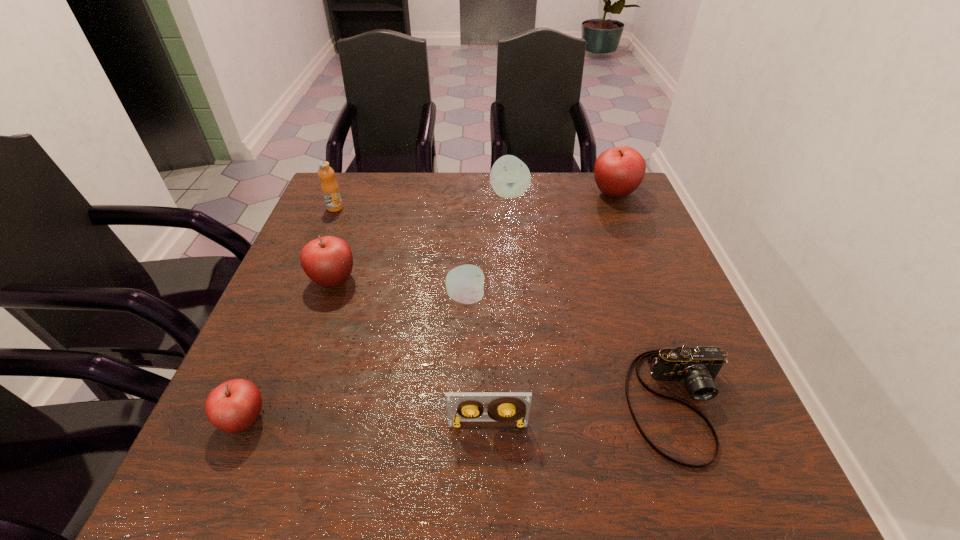
I want to click on vacant area located 0.050m on the front-facing side of the shortest object, so 716,501.

Where is `orange juice situated at the far edge`? This screenshot has width=960, height=540. orange juice situated at the far edge is located at coordinates (330, 189).

You are a GUI agent. You are given a task and a screenshot of the screen. Output one action in this format:
    pyautogui.click(x=<x>, y=<y>)
    Task: Click on the object that is at the near edge
    Image resolution: width=960 pixels, height=540 pixels.
    Given the screenshot: What is the action you would take?
    pyautogui.click(x=697, y=367)

You are a GUI agent. You are given a task and a screenshot of the screen. Output one action in this format:
    pyautogui.click(x=<x>, y=<y>)
    Task: Click on the orange juice that is at the left edge
    This screenshot has height=540, width=960.
    Given the screenshot: What is the action you would take?
    (x=330, y=189)

Locate an element on the screen. The image size is (960, 540). apple at the right edge is located at coordinates pos(618,171).

At what (x,y) coordinates should I click in order to perform the action: click on camera that is at the right edge. Please return your answer as a coordinate pair (x, y). The image size is (960, 540). Looking at the image, I should click on (697, 367).

Image resolution: width=960 pixels, height=540 pixels. I want to click on object positioned at the far left corner, so click(330, 189).

This screenshot has height=540, width=960. Identify the location of object present at the far right corner. (618, 171).

Find the location of a particular element. The width and height of the screenshot is (960, 540). object present at the near right corner is located at coordinates (697, 367).

Where is `free space at the far edge`? The image size is (960, 540). free space at the far edge is located at coordinates (426, 180).